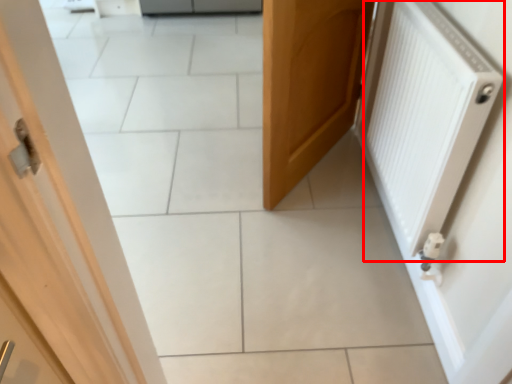
Question: From the image's perspective, considering the relative positions of radiator (annotated by the red box) and door in the image provided, where is radiator (annotated by the red box) located with respect to the staircase?

Choices:
 (A) above
 (B) below

Answer: (B)